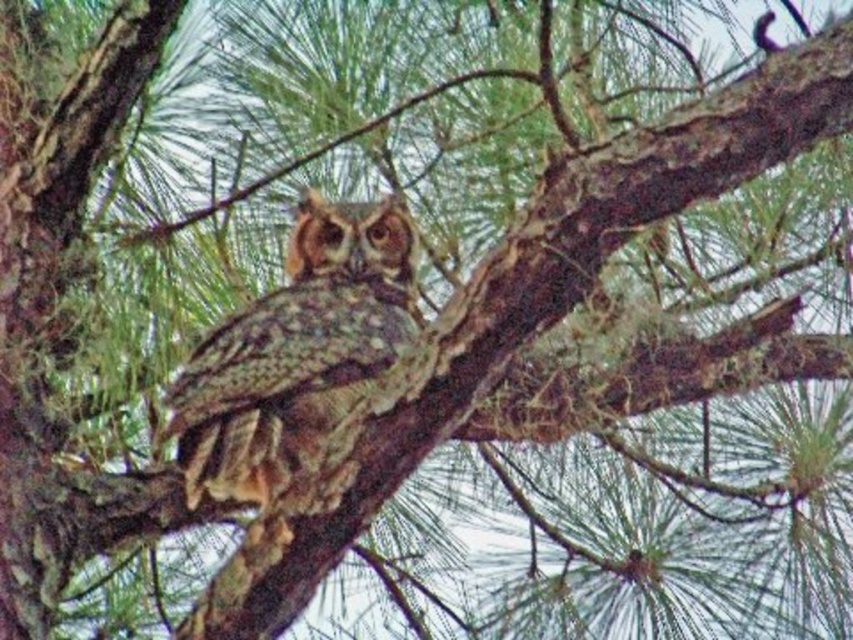
You are a nature photographer standing 2 meters away from a pine tree. You want to take a photo of the camouflage feathers owl at center. Is the owl within your camera range if your camera can focus up to 3 meters?

The camouflage feathers owl at center is 3.07 meters away from the viewer. Since the camera can focus up to 3 meters, the owl is slightly out of range by 0.07 meters.

You are an ornithologist analyzing the position of the camouflage feathers owl at center in the image. What are the coordinates of the owl in the image?

The camouflage feathers owl at center is located at coordinates point (294, 349).